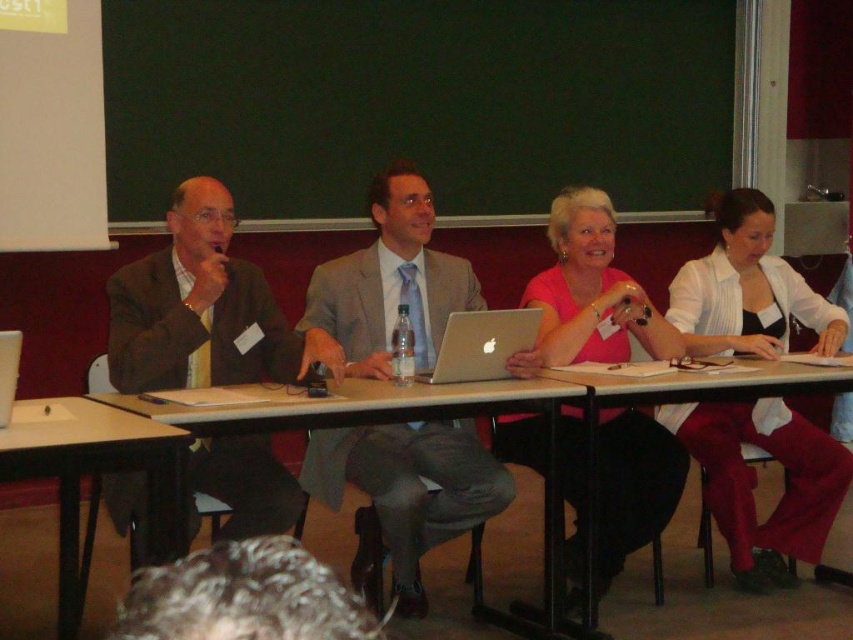
You are organizing a meeting in a conference room with a dark green chalkboard and a projection screen on the left. You need to place a new speaker at the exact position where the light gray suit at center is currently located. What are the coordinates of the position where you should place the speaker?

The coordinates for the position where the light gray suit at center is located are at point (409,486).

You are organizing a presentation and need to place a 1.5 meter wide banner between the light gray suit at center and the silver metallic laptop at center. Can the banner fit in the space between them?

The light gray suit at center is larger in size than the silver metallic laptop at center, but the description does not provide specific measurements of the distance between them. Therefore, it is unclear if the 1.5 meter wide banner can fit in the space between them.